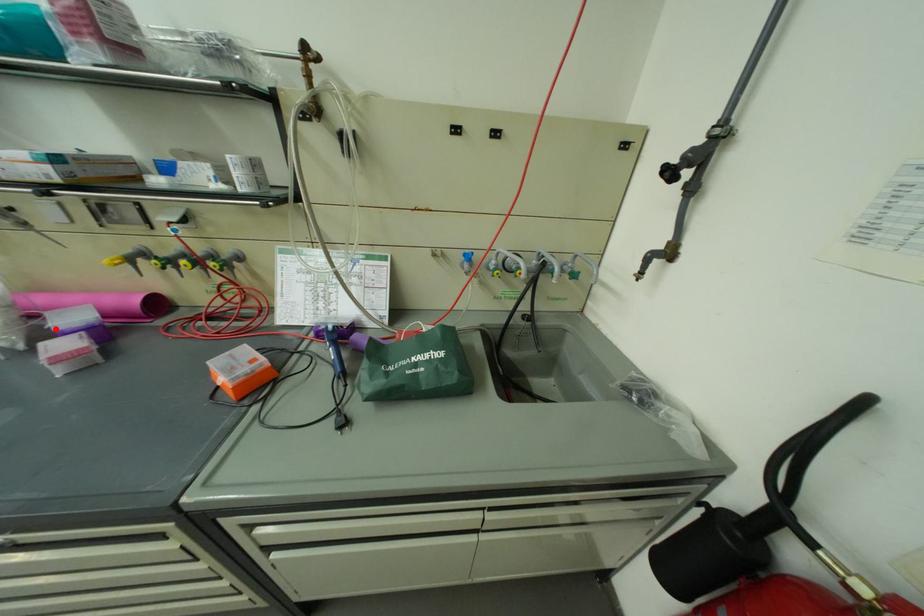
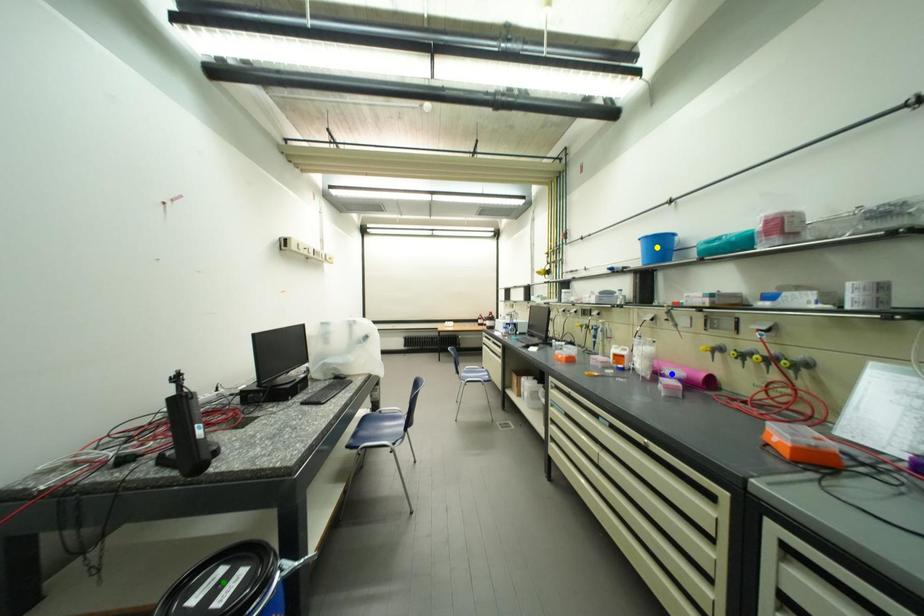
Question: I am providing you with two images of the same scene from different viewpoints. A red point is marked on the first image. You are given multiple points on the second image. Which spot in image 2 lines up with the point in image 1?

Choices:
 (A) yellow point
 (B) green point
 (C) blue point

Answer: (C)